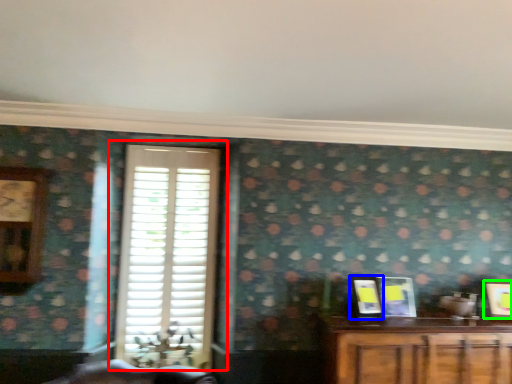
Question: Which object is the farthest from window (highlighted by a red box)? Choose among these: picture frame (highlighted by a blue box) or picture frame (highlighted by a green box).

Choices:
 (A) picture frame
 (B) picture frame

Answer: (B)